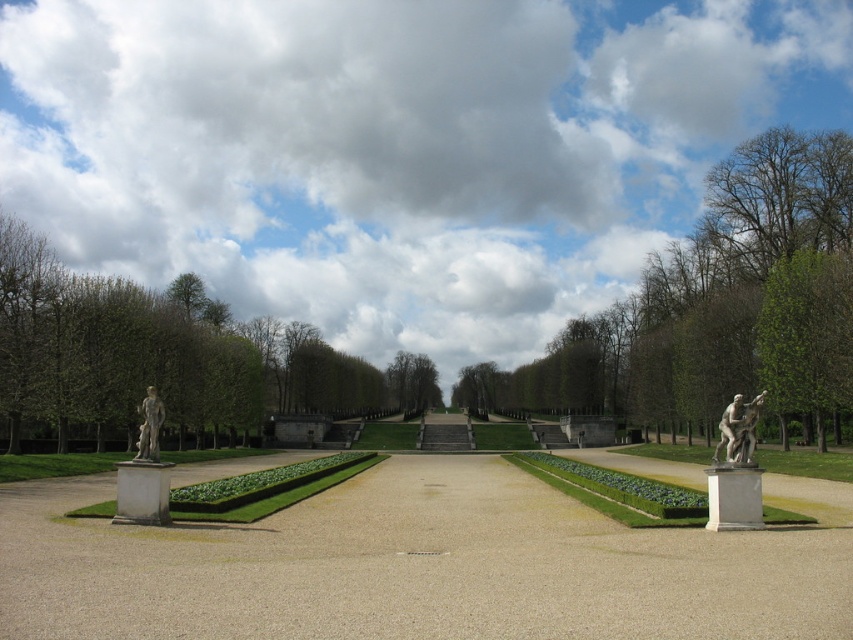
You are a gardener planning to plant a new row of flowers along the edge of the smooth concrete path at center and the green leafy tree at center. Which area would require more space to accommodate the new flowers?

The green leafy tree at center requires more space for the new flowers since it occupies more space than the smooth concrete path at center according to the description.

You are planning to take a photo of the smooth concrete path at center and the green leafy tree at center from the front. Which object will appear taller in the photo?

The green leafy tree at center will appear taller in the photo because it is taller than the smooth concrete path at center.

You are standing at the center of the pathway in the garden. There is a green leafy tree at center. A point is marked at coordinates [718,305]. Where is this point located?

The point at coordinates [718,305] is located on the green leafy tree at center.